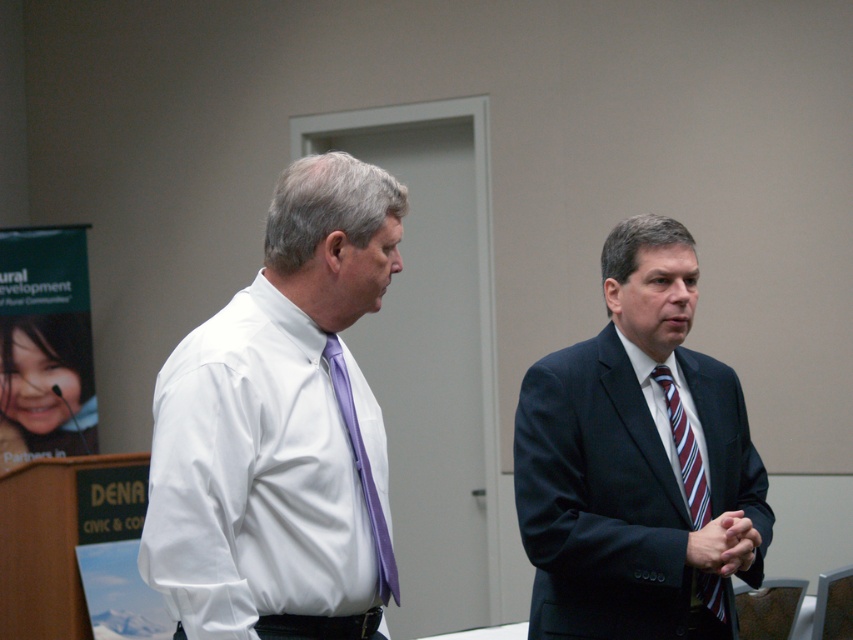
Question: Among these objects, which one is farthest from the camera?

Choices:
 (A) striped fabric tie at center
 (B) dark blue suit at right

Answer: (A)

Question: Does dark blue suit at right appear under striped fabric tie at center?

Choices:
 (A) no
 (B) yes

Answer: (A)

Question: Is white smooth shirt at left closer to camera compared to striped fabric tie at center?

Choices:
 (A) yes
 (B) no

Answer: (A)

Question: Which object appears farthest from the camera in this image?

Choices:
 (A) white smooth shirt at left
 (B) purple silk tie at center
 (C) dark blue suit at right
 (D) striped fabric tie at center

Answer: (D)

Question: Among these objects, which one is nearest to the camera?

Choices:
 (A) purple silk tie at center
 (B) white smooth shirt at left
 (C) dark blue suit at right
 (D) striped fabric tie at center

Answer: (B)

Question: Can you confirm if striped fabric tie at center is positioned to the left of purple silk tie at center?

Choices:
 (A) yes
 (B) no

Answer: (B)